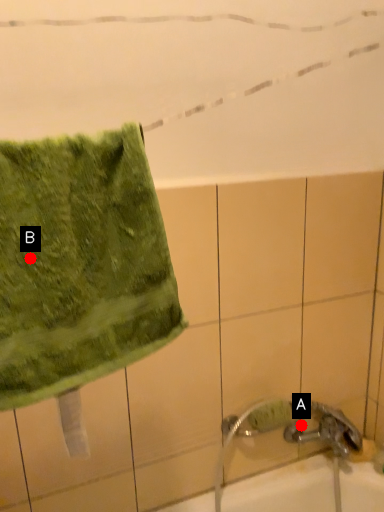
Question: Two points are circled on the image, labeled by A and B beside each circle. Among these points, which one is nearest to the camera?

Choices:
 (A) A is closer
 (B) B is closer

Answer: (B)